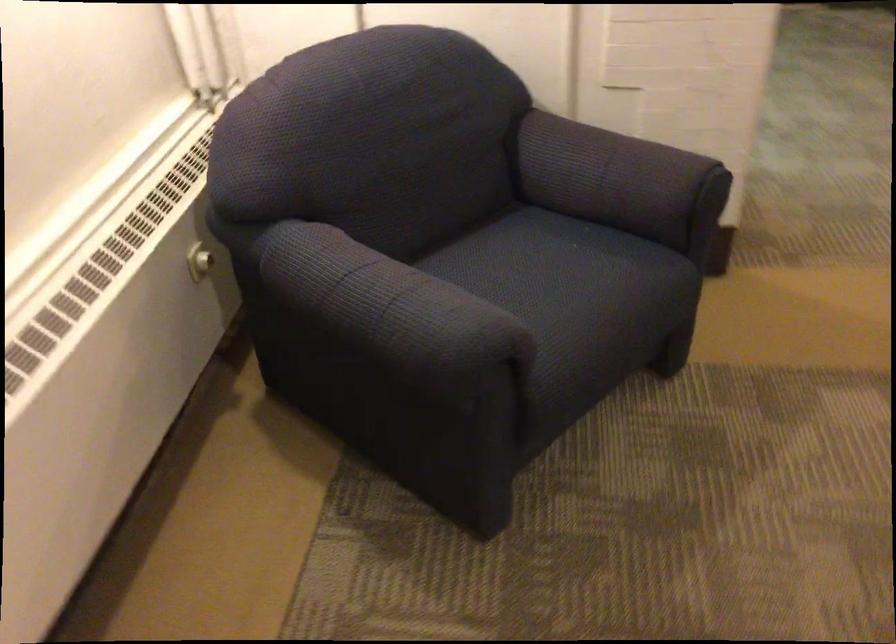
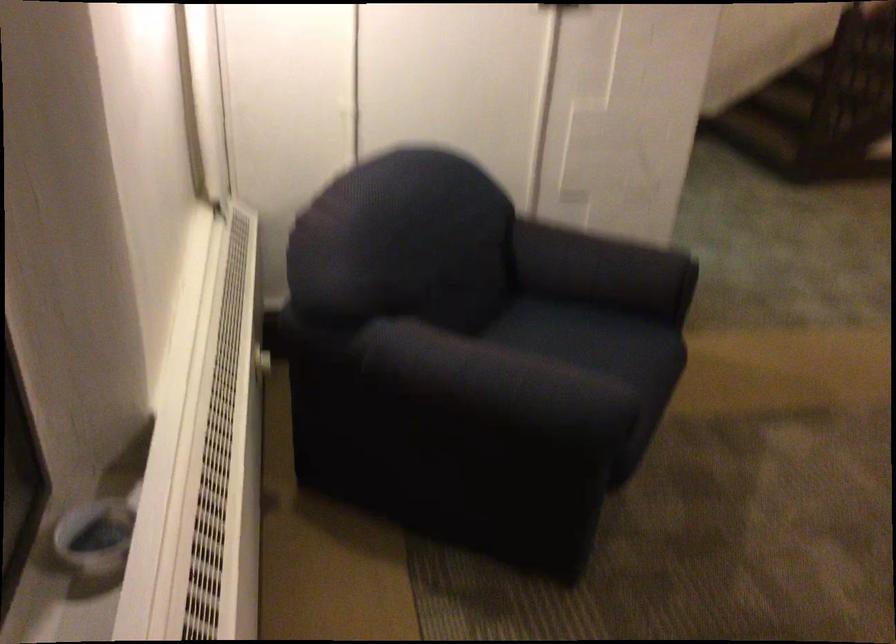
The point at [549,285] is marked in the first image. Where is the corresponding point in the second image?

(601, 355)